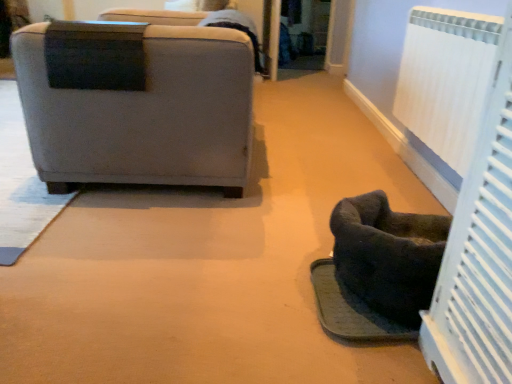
Question: Considering the relative sizes of gray fabric chair at left and white textured radiator at right in the image provided, is gray fabric chair at left smaller than white textured radiator at right?

Choices:
 (A) yes
 (B) no

Answer: (B)

Question: Is white textured radiator at right a part of gray fabric chair at left?

Choices:
 (A) no
 (B) yes

Answer: (A)

Question: From the image's perspective, would you say gray fabric chair at left is positioned over white textured radiator at right?

Choices:
 (A) yes
 (B) no

Answer: (A)

Question: From a real-world perspective, is gray fabric chair at left on top of white textured radiator at right?

Choices:
 (A) no
 (B) yes

Answer: (A)

Question: Is gray fabric chair at left thinner than white textured radiator at right?

Choices:
 (A) no
 (B) yes

Answer: (A)

Question: Considering the relative sizes of gray fabric chair at left and white textured radiator at right in the image provided, is gray fabric chair at left shorter than white textured radiator at right?

Choices:
 (A) no
 (B) yes

Answer: (A)

Question: From a real-world perspective, is dark fabric pet bed at lower right located higher than white textured radiator at right?

Choices:
 (A) no
 (B) yes

Answer: (A)

Question: Does dark fabric pet bed at lower right have a smaller size compared to white textured radiator at right?

Choices:
 (A) no
 (B) yes

Answer: (B)

Question: Can you confirm if dark fabric pet bed at lower right is wider than white textured radiator at right?

Choices:
 (A) no
 (B) yes

Answer: (B)

Question: Is dark fabric pet bed at lower right outside of white textured radiator at right?

Choices:
 (A) no
 (B) yes

Answer: (B)

Question: Considering the relative sizes of dark fabric pet bed at lower right and white textured radiator at right in the image provided, is dark fabric pet bed at lower right taller than white textured radiator at right?

Choices:
 (A) no
 (B) yes

Answer: (A)

Question: Is dark fabric pet bed at lower right oriented towards white textured radiator at right?

Choices:
 (A) no
 (B) yes

Answer: (A)

Question: Can you confirm if dark gray fabric footrest at lower right is smaller than gray fabric chair at left?

Choices:
 (A) yes
 (B) no

Answer: (A)